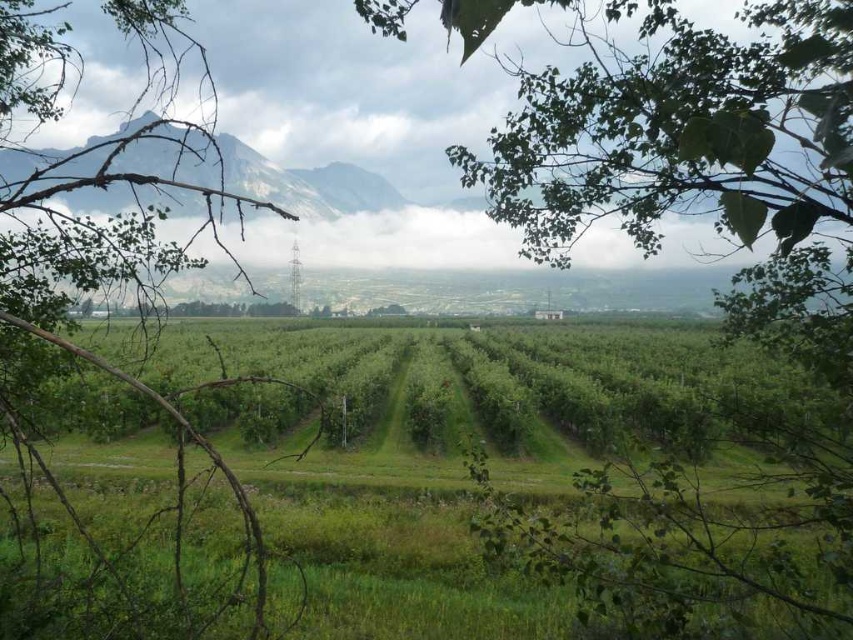
Question: Is green leafy branch at left to the right of gray rocky mountain at upper center from the viewer's perspective?

Choices:
 (A) no
 (B) yes

Answer: (A)

Question: Can you confirm if green leafy branch at left is positioned below gray rocky mountain at upper center?

Choices:
 (A) yes
 (B) no

Answer: (A)

Question: Which of the following is the closest to the observer?

Choices:
 (A) green leafy branch at left
 (B) gray rocky mountain at upper center

Answer: (A)

Question: Which object appears closest to the camera in this image?

Choices:
 (A) green leafy tree at center
 (B) green leafy branch at left

Answer: (B)

Question: Which is farther from the green leafy tree at center?

Choices:
 (A) gray rocky mountain at upper center
 (B) green leafy branch at left

Answer: (A)

Question: From the image, what is the correct spatial relationship of green leafy tree at center in relation to green leafy branch at left?

Choices:
 (A) left
 (B) right

Answer: (B)